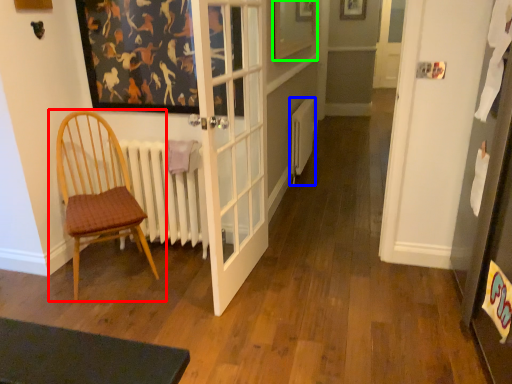
Question: Which object is positioned closest to chair (highlighted by a red box)? Select from heater (highlighted by a blue box) and picture frame (highlighted by a green box).

Choices:
 (A) heater
 (B) picture frame

Answer: (B)